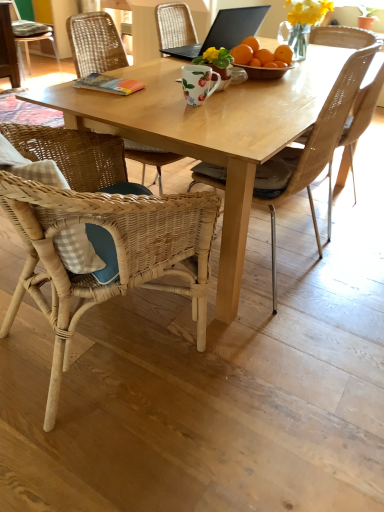
Where is `free point to the right of floral matte coffee cup at center`? free point to the right of floral matte coffee cup at center is located at coordinates (250, 101).